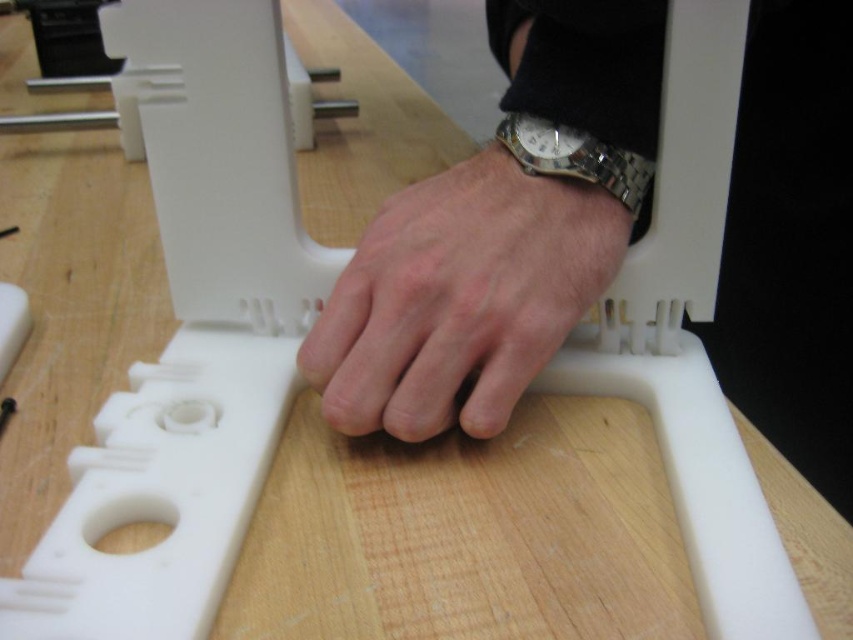
Consider the image. Is skinny silver watch at center to the right of gold-toned metallic watch at center from the viewer's perspective?

In fact, skinny silver watch at center is to the left of gold-toned metallic watch at center.

What are the coordinates of `skinny silver watch at center` in the screenshot? It's located at (460, 298).

Identify the location of skinny silver watch at center. The width and height of the screenshot is (853, 640). (460, 298).